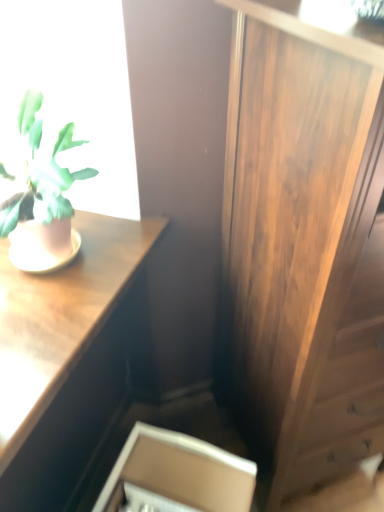
What are the coordinates of `vacant area that is in front of pink matte flowerpot at left` in the screenshot? It's located at (43, 307).